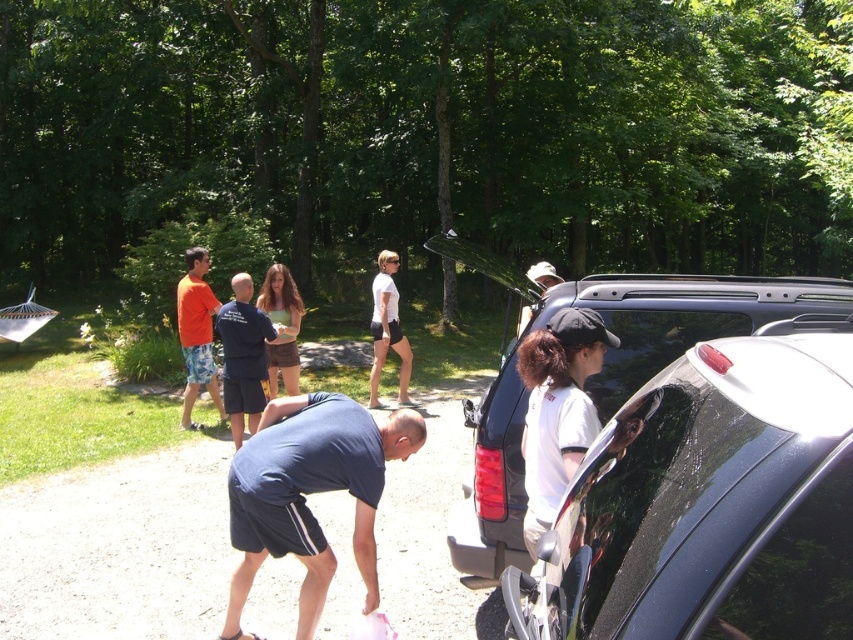
Does point (372, 460) come behind point (401, 368)?

That is False.

Is dark blue fabric shirt at lower center positioned before white matte shorts at center?

Yes, it is in front of white matte shorts at center.

Between point (268, 544) and point (380, 362), which one is positioned behind?

The point (380, 362) is behind.

Find the location of a particular element. dark blue fabric shirt at lower center is located at coordinates (310, 492).

The height and width of the screenshot is (640, 853). What do you see at coordinates (556, 408) in the screenshot?
I see `white matte shirt at right` at bounding box center [556, 408].

In the scene shown: Can you confirm if white matte shirt at right is positioned above dark blue shirt at center?

Correct, white matte shirt at right is located above dark blue shirt at center.

Find the location of a particular element. white matte shirt at right is located at coordinates (556, 408).

Between shiny black car at lower right and orange cotton shirt at left, which one is positioned lower?

shiny black car at lower right

Is the position of shiny black car at lower right less distant than that of orange cotton shirt at left?

Yes, shiny black car at lower right is closer to the viewer.

Between point (631, 554) and point (183, 392), which one is positioned in front?

Point (631, 554)

Find the location of a particular element. shiny black car at lower right is located at coordinates (708, 506).